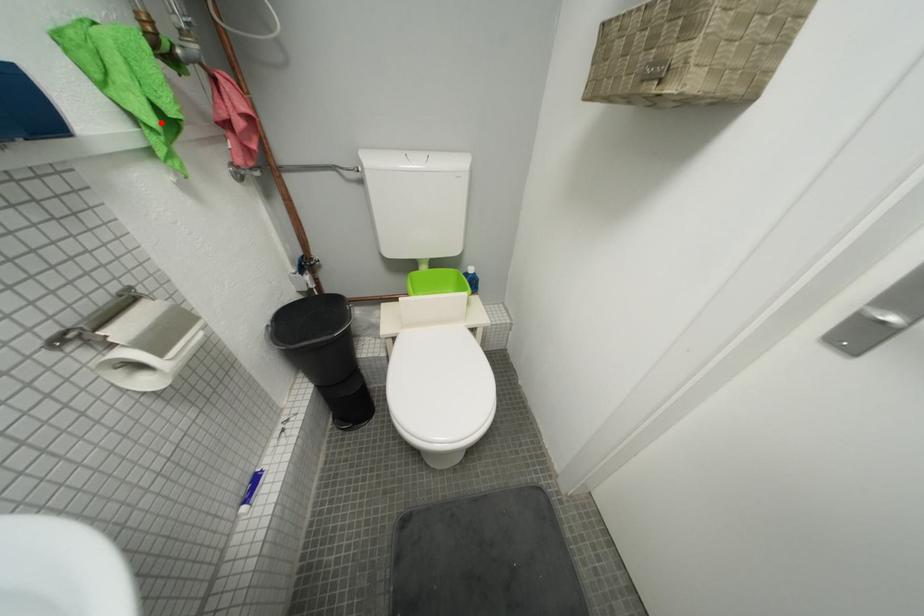
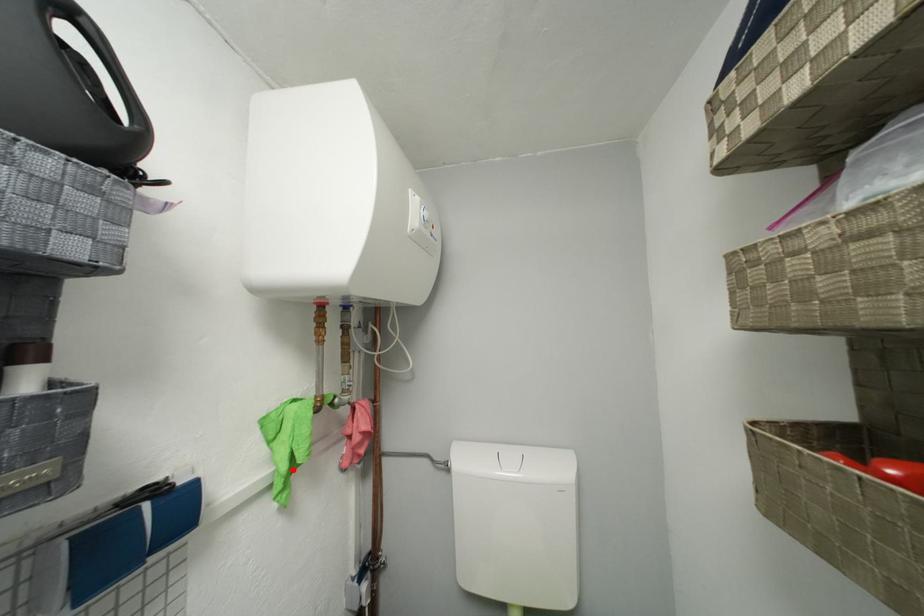
I am providing you with two images of the same scene from different viewpoints. A red point is marked on the first image and another point is marked on the second image. Does the point marked in image1 correspond to the same location as the one in image2?

Yes